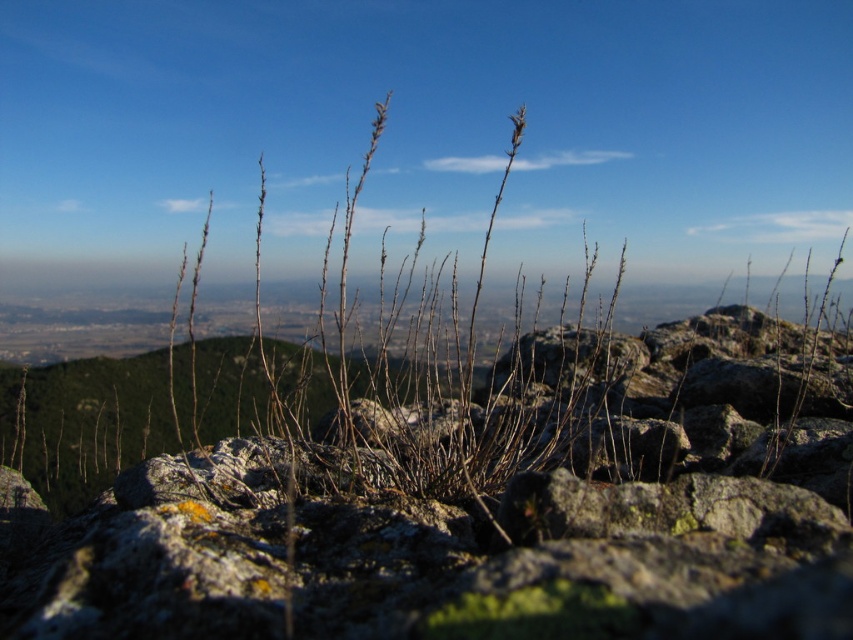
Can you confirm if gray rough rock at center is positioned below brown dry grass at center?

Indeed, gray rough rock at center is positioned under brown dry grass at center.

Is the position of gray rough rock at center more distant than that of brown dry grass at center?

No, gray rough rock at center is closer to the viewer.

This screenshot has width=853, height=640. What are the coordinates of `gray rough rock at center` in the screenshot? It's located at (486, 509).